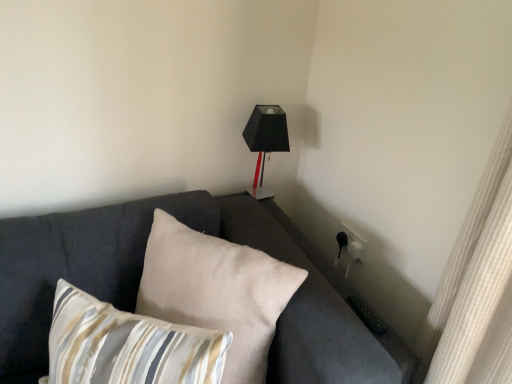
Question: Considering the relative sizes of beige fabric pillow at center, which appears as the second pillow when viewed from the front, and dark gray fabric couch at center in the image provided, is beige fabric pillow at center, which appears as the second pillow when viewed from the front, shorter than dark gray fabric couch at center?

Choices:
 (A) yes
 (B) no

Answer: (B)

Question: Can you confirm if beige fabric pillow at center, which is the first pillow in back-to-front order, is thinner than dark gray fabric couch at center?

Choices:
 (A) no
 (B) yes

Answer: (B)

Question: Could you tell me if beige fabric pillow at center, which appears as the second pillow when viewed from the front, is facing dark gray fabric couch at center?

Choices:
 (A) no
 (B) yes

Answer: (B)

Question: Is beige fabric pillow at center, which is the first pillow in back-to-front order, next to dark gray fabric couch at center and touching it?

Choices:
 (A) yes
 (B) no

Answer: (B)

Question: Is beige fabric pillow at center, which appears as the second pillow when viewed from the front, located outside dark gray fabric couch at center?

Choices:
 (A) yes
 (B) no

Answer: (B)

Question: Looking at the image, does dark gray fabric couch at center seem bigger or smaller compared to striped fabric pillow at lower left, placed as the 2th pillow when sorted from back to front?

Choices:
 (A) small
 (B) big

Answer: (B)

Question: In terms of width, does dark gray fabric couch at center look wider or thinner when compared to striped fabric pillow at lower left, positioned as the 1th pillow in front-to-back order?

Choices:
 (A) wide
 (B) thin

Answer: (A)

Question: From the image's perspective, relative to striped fabric pillow at lower left, positioned as the 1th pillow in front-to-back order, is dark gray fabric couch at center above or below?

Choices:
 (A) above
 (B) below

Answer: (A)

Question: Considering the relative positions of dark gray fabric couch at center and striped fabric pillow at lower left, placed as the 2th pillow when sorted from back to front, in the image provided, is dark gray fabric couch at center to the left or to the right of striped fabric pillow at lower left, placed as the 2th pillow when sorted from back to front,?

Choices:
 (A) left
 (B) right

Answer: (B)

Question: Is striped fabric pillow at lower left, positioned as the 1th pillow in front-to-back order, wider or thinner than matte black lampshade at upper right?

Choices:
 (A) thin
 (B) wide

Answer: (B)

Question: Looking at the image, does striped fabric pillow at lower left, positioned as the 1th pillow in front-to-back order, seem bigger or smaller compared to matte black lampshade at upper right?

Choices:
 (A) big
 (B) small

Answer: (A)

Question: From their relative heights in the image, would you say striped fabric pillow at lower left, positioned as the 1th pillow in front-to-back order, is taller or shorter than matte black lampshade at upper right?

Choices:
 (A) short
 (B) tall

Answer: (A)

Question: Is striped fabric pillow at lower left, placed as the 2th pillow when sorted from back to front, inside the boundaries of matte black lampshade at upper right, or outside?

Choices:
 (A) outside
 (B) inside

Answer: (A)

Question: Considering the positions of striped fabric pillow at lower left, positioned as the 1th pillow in front-to-back order, and beige fabric pillow at center, which appears as the second pillow when viewed from the front, in the image, is striped fabric pillow at lower left, positioned as the 1th pillow in front-to-back order, wider or thinner than beige fabric pillow at center, which appears as the second pillow when viewed from the front,?

Choices:
 (A) thin
 (B) wide

Answer: (B)

Question: In the image, is striped fabric pillow at lower left, placed as the 2th pillow when sorted from back to front, on the left side or the right side of beige fabric pillow at center, which is the first pillow in back-to-front order?

Choices:
 (A) left
 (B) right

Answer: (A)